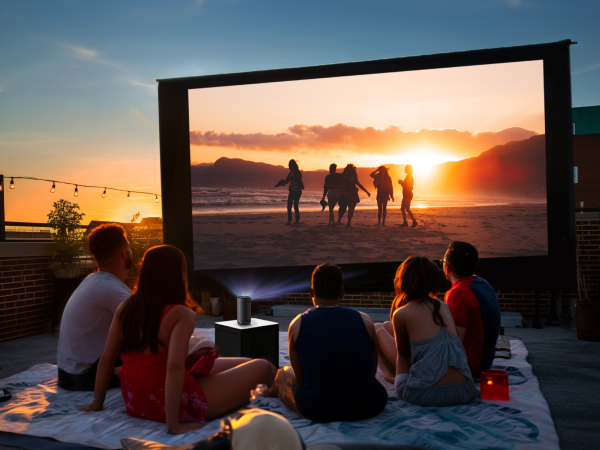
Image resolution: width=600 pixels, height=450 pixels. Identify the location of lightbulbs. (12, 184), (52, 190), (75, 193), (104, 196), (129, 197), (157, 201).